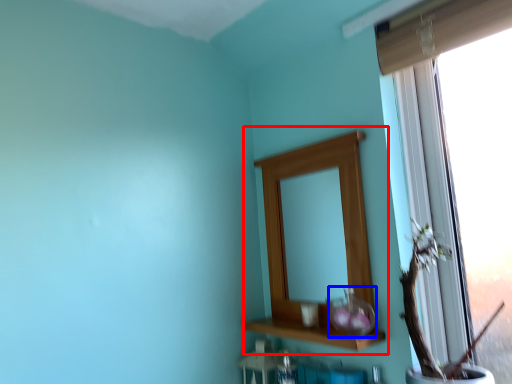
Question: Which of the following is the closest to the observer, medicine cabinet (highlighted by a red box) or glass vase (highlighted by a blue box)?

Choices:
 (A) medicine cabinet
 (B) glass vase

Answer: (B)